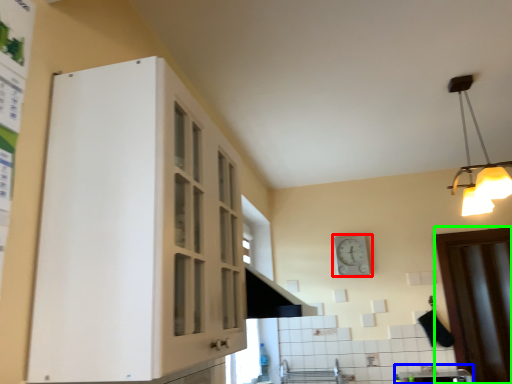
Question: Considering the real-world distances, which object is closest to clock (highlighted by a red box)? sink (highlighted by a blue box) or door (highlighted by a green box).

Choices:
 (A) sink
 (B) door

Answer: (B)